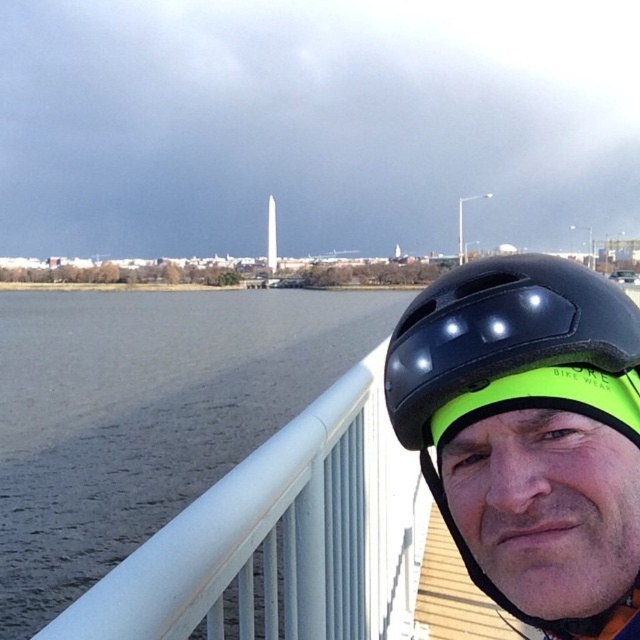
Between gray matte water at left and black matte helmet at upper right, which one is positioned lower?

gray matte water at left is lower down.

Which is more to the right, gray matte water at left or black matte helmet at upper right?

black matte helmet at upper right is more to the right.

The image size is (640, 640). I want to click on gray matte water at left, so click(x=145, y=413).

Where is `gray matte water at left`? Image resolution: width=640 pixels, height=640 pixels. gray matte water at left is located at coordinates pos(145,413).